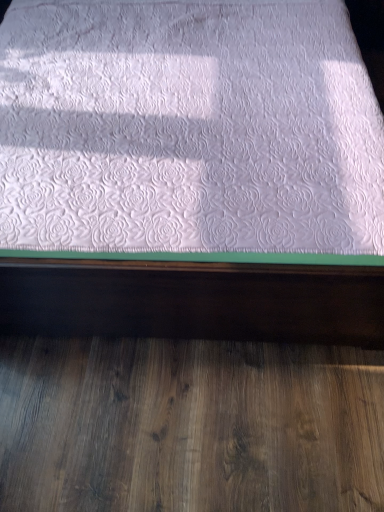
Where is `white quilted mattress at center`? white quilted mattress at center is located at coordinates (189, 172).

This screenshot has height=512, width=384. Describe the element at coordinates (189, 172) in the screenshot. I see `white quilted mattress at center` at that location.

In order to click on white quilted mattress at center in this screenshot , I will do `click(189, 172)`.